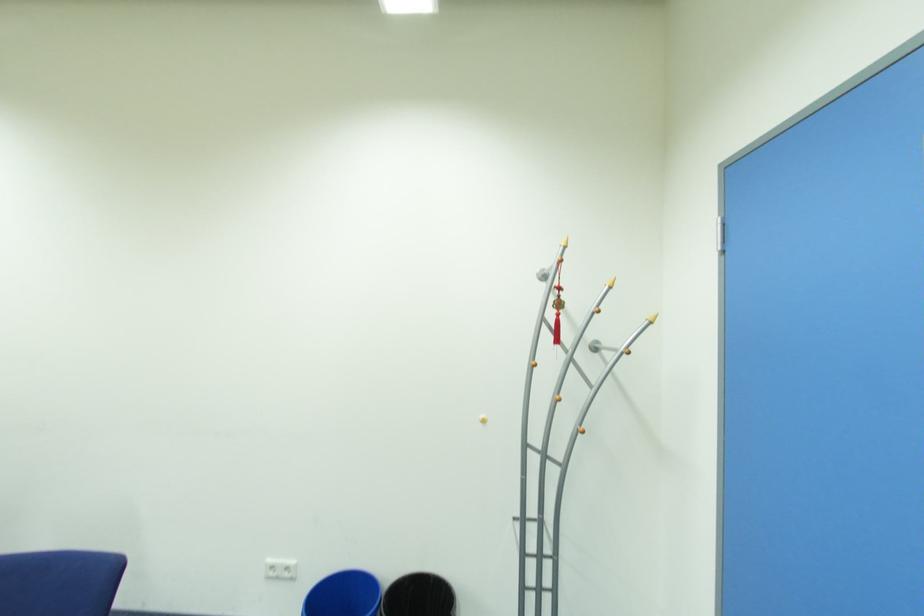
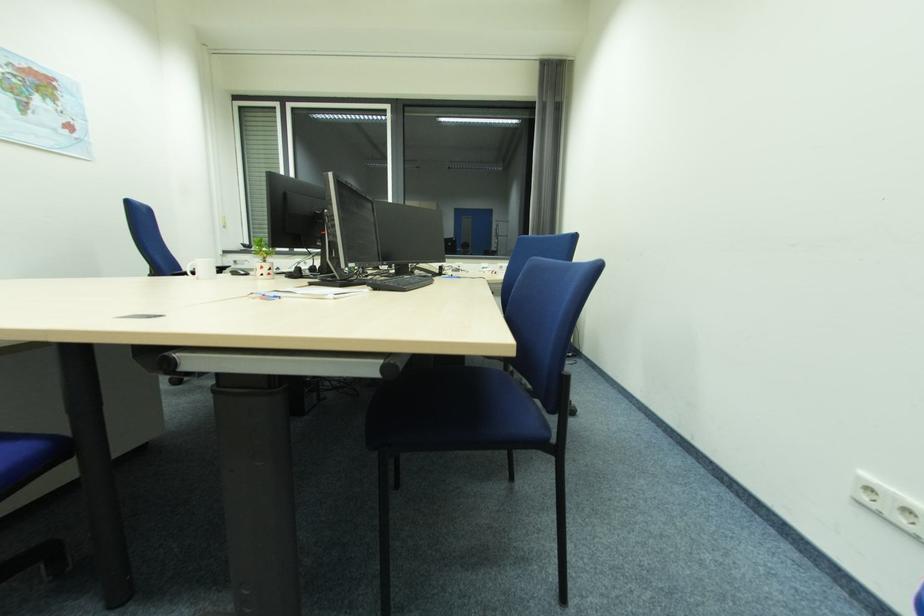
Question: How did the camera likely rotate?

Choices:
 (A) Left
 (B) Right
 (C) Up
 (D) Down

Answer: (A)